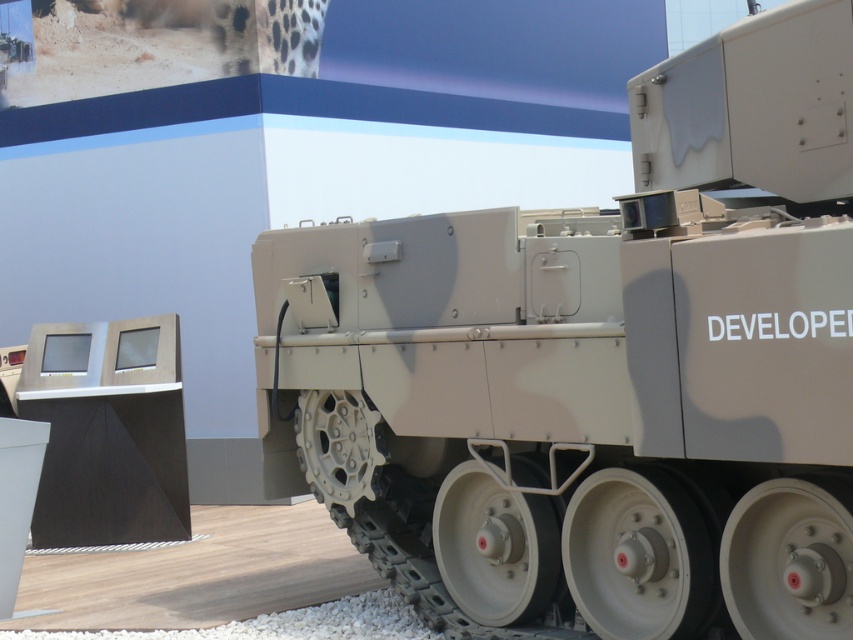
Based on the scene description, where is the camouflage paint tank at center located in terms of coordinates?

The camouflage paint tank at center is located at point coordinates of (602, 369).

You are a military technician inspecting the camouflage paint tank at center and the black matte monitor at lower left. Which object is positioned higher on the vehicle?

The camouflage paint tank at center is located above the black matte monitor at lower left, so it is positioned higher on the vehicle.